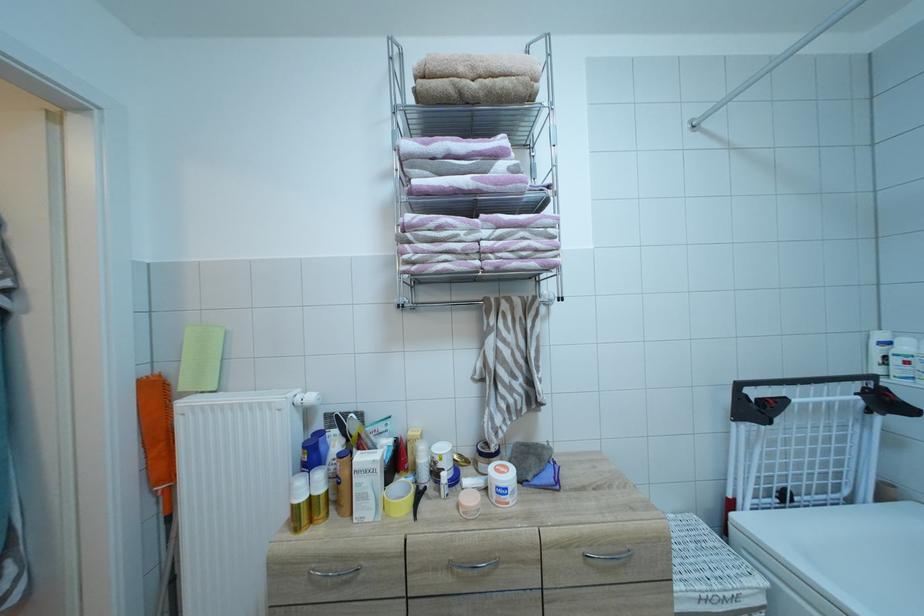
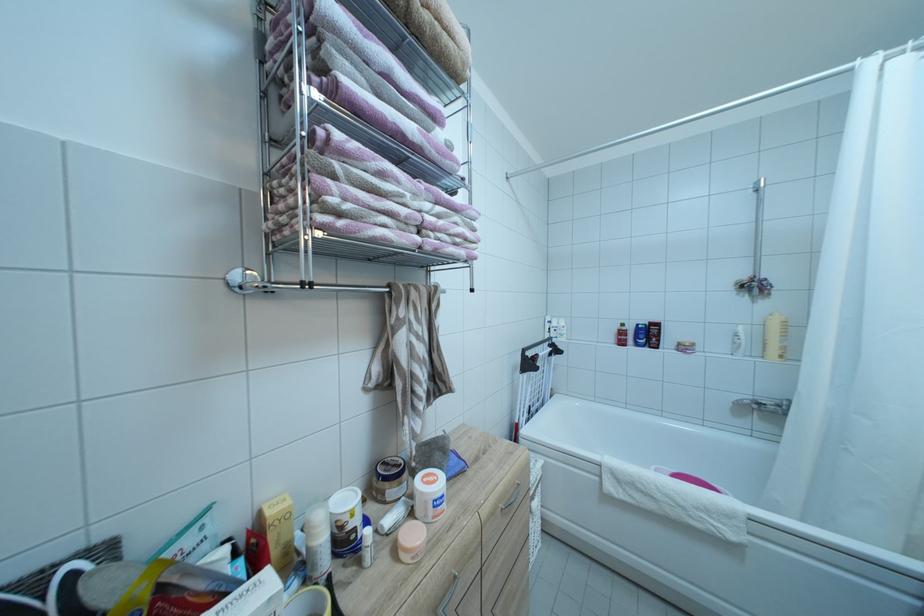
Where in the second image is the point corresponding to (505,233) from the first image?

(444, 209)